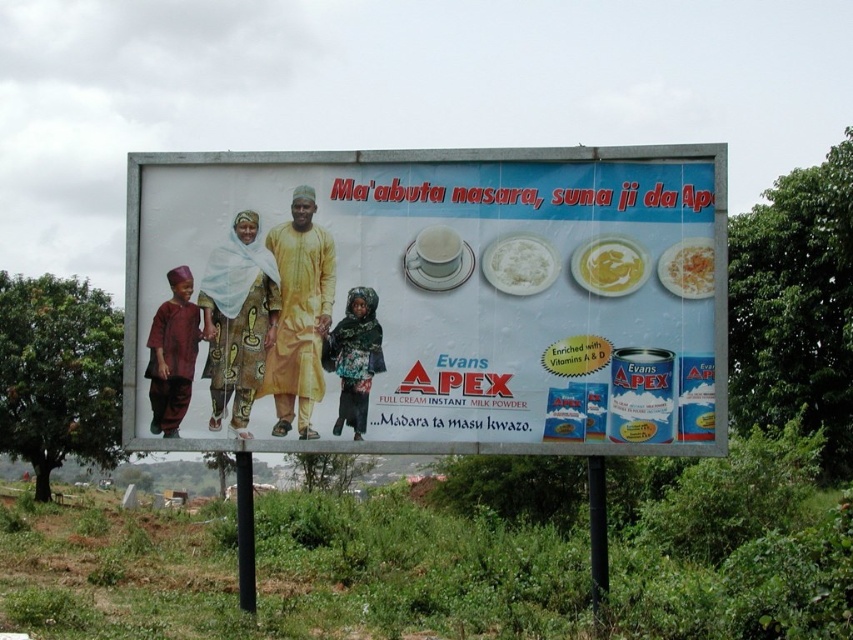
Question: Which point is closer to the camera?

Choices:
 (A) (602, 248)
 (B) (724, 177)
 (C) (668, 272)
 (D) (521, 243)

Answer: (B)

Question: Is matte yellow fabric at center positioned before yellow creamy sauce at upper center?

Choices:
 (A) yes
 (B) no

Answer: (A)

Question: Can you confirm if white powder at upper center is positioned to the right of yellow creamy sauce at upper center?

Choices:
 (A) no
 (B) yes

Answer: (A)

Question: Which point is farther from the camera taking this photo?

Choices:
 (A) (682, 248)
 (B) (502, 289)

Answer: (B)

Question: Which object is the farthest from the white powder at upper center?

Choices:
 (A) matte yellow fabric at center
 (B) smooth yellow rice at center

Answer: (B)

Question: Does matte yellow fabric at center come in front of white powder at upper center?

Choices:
 (A) yes
 (B) no

Answer: (A)